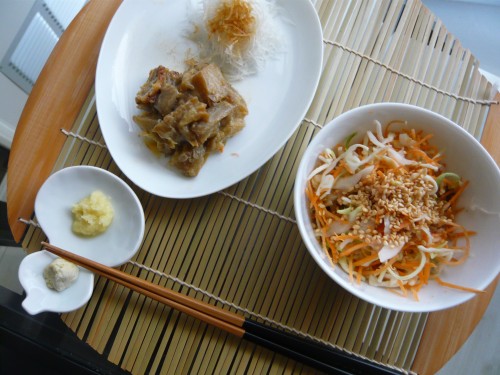
The height and width of the screenshot is (375, 500). In order to click on handles in this screenshot , I will do `click(336, 355)`, `click(328, 368)`.